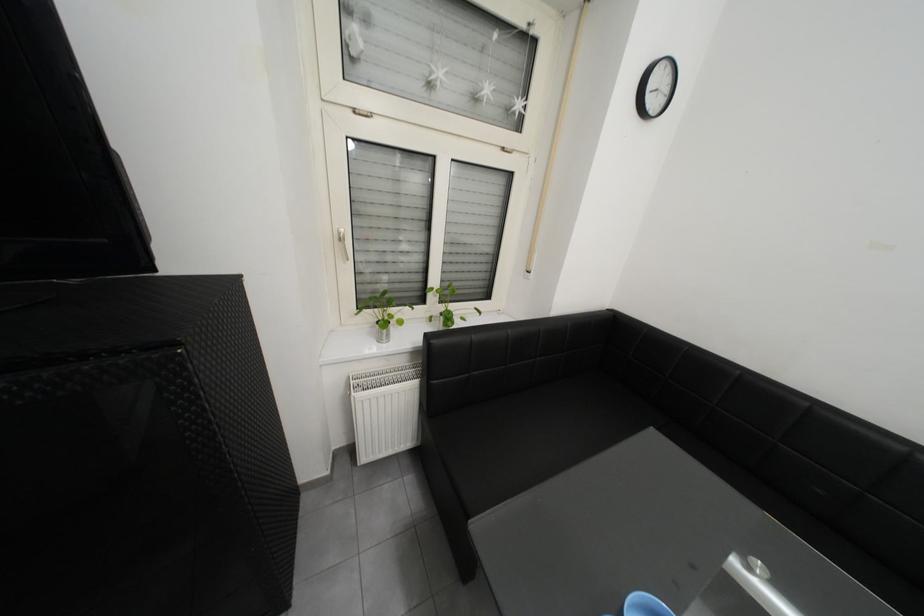
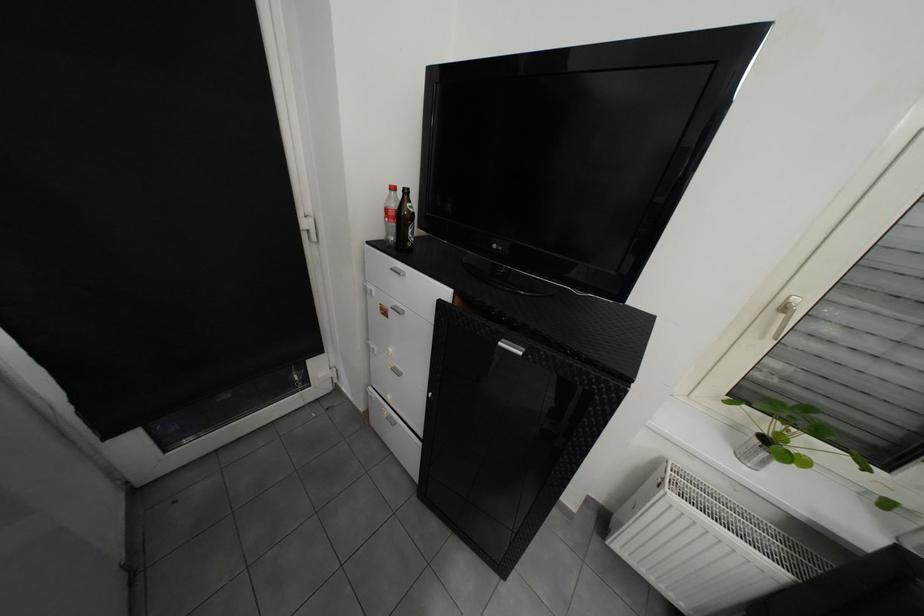
The point at [392,342] is marked in the first image. Where is the corresponding point in the second image?

(754, 458)